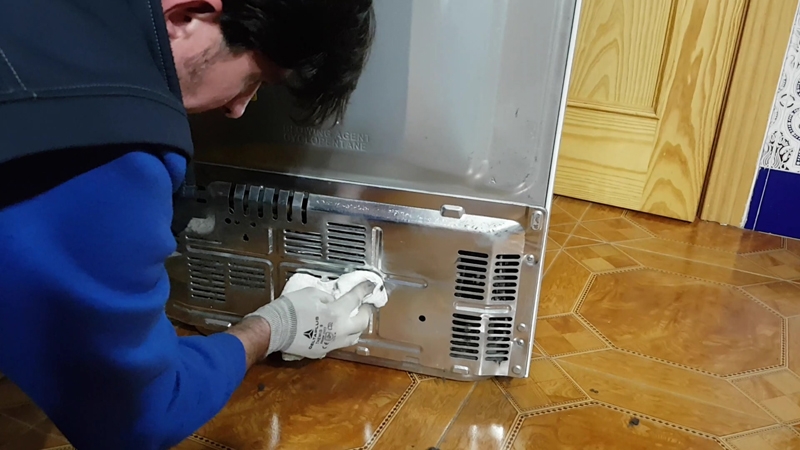
The width and height of the screenshot is (800, 450). Identify the location of door. (646, 115).